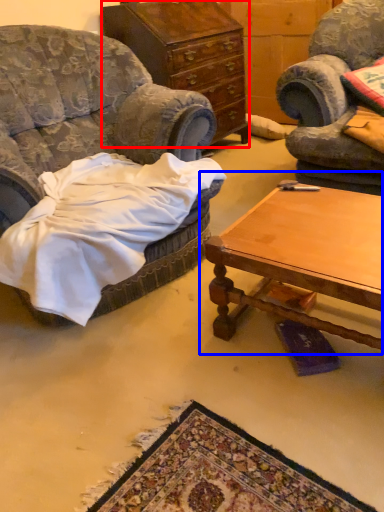
Question: Which object appears closest to the camera in this image, cabinetry (highlighted by a red box) or coffee table (highlighted by a blue box)?

Choices:
 (A) cabinetry
 (B) coffee table

Answer: (B)